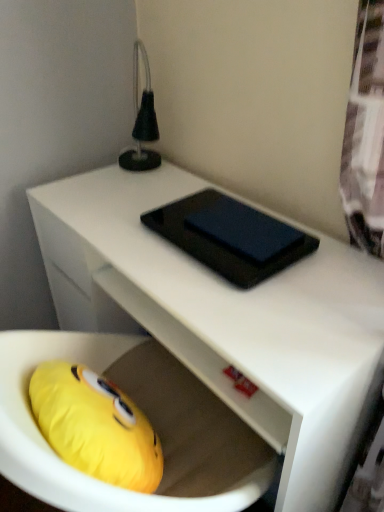
Question: Is white matte desk at center next to black glossy tablet at center?

Choices:
 (A) yes
 (B) no

Answer: (B)

Question: From the image's perspective, is white matte desk at center under black glossy tablet at center?

Choices:
 (A) no
 (B) yes

Answer: (B)

Question: Is white matte desk at center smaller than black glossy tablet at center?

Choices:
 (A) no
 (B) yes

Answer: (A)

Question: Considering the relative sizes of white matte desk at center and black glossy tablet at center in the image provided, is white matte desk at center wider than black glossy tablet at center?

Choices:
 (A) no
 (B) yes

Answer: (B)

Question: From a real-world perspective, is white matte desk at center physically below black glossy tablet at center?

Choices:
 (A) no
 (B) yes

Answer: (B)

Question: Does white matte desk at center have a lesser width compared to black glossy tablet at center?

Choices:
 (A) yes
 (B) no

Answer: (B)

Question: Is black glossy tablet at center in contact with white matte desk at center?

Choices:
 (A) no
 (B) yes

Answer: (A)

Question: From a real-world perspective, is black glossy tablet at center on top of white matte desk at center?

Choices:
 (A) no
 (B) yes

Answer: (B)

Question: Does black glossy tablet at center have a lesser width compared to white matte desk at center?

Choices:
 (A) no
 (B) yes

Answer: (B)

Question: Considering the relative positions of black glossy tablet at center and white matte desk at center in the image provided, is black glossy tablet at center behind white matte desk at center?

Choices:
 (A) no
 (B) yes

Answer: (B)

Question: From the image's perspective, is black glossy tablet at center on white matte desk at center?

Choices:
 (A) no
 (B) yes

Answer: (B)

Question: Is black glossy tablet at center smaller than white matte desk at center?

Choices:
 (A) yes
 (B) no

Answer: (A)

Question: Is black glossy tablet at center inside the boundaries of white matte desk at center, or outside?

Choices:
 (A) inside
 (B) outside

Answer: (B)